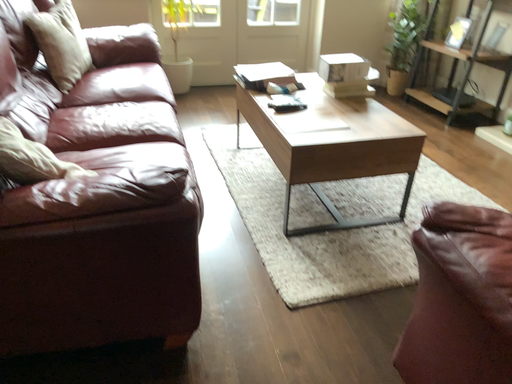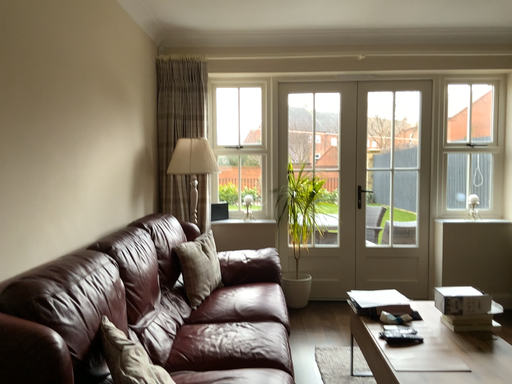
Question: Which way did the camera rotate in the video?

Choices:
 (A) rotated upward
 (B) rotated downward

Answer: (A)